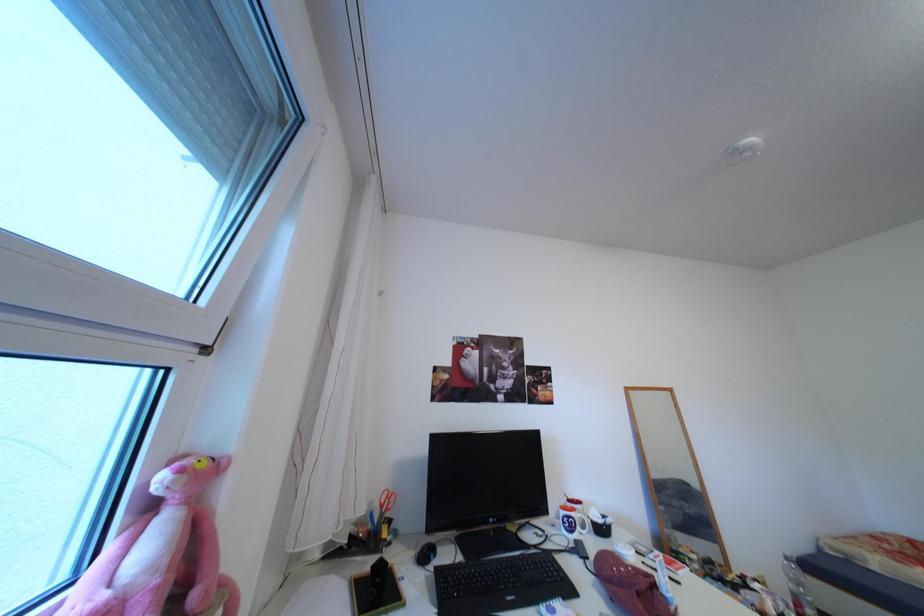
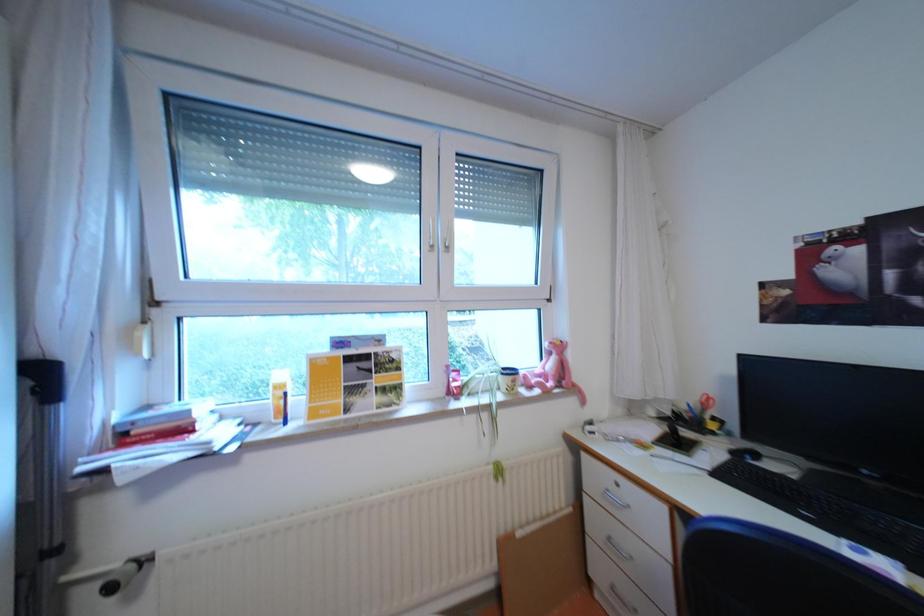
Question: The camera is either moving clockwise (left) or counter-clockwise (right) around the object. The first image is from the beginning of the video and the second image is from the end. Is the camera moving left or right when shooting the video?

Choices:
 (A) Left
 (B) Right

Answer: (B)